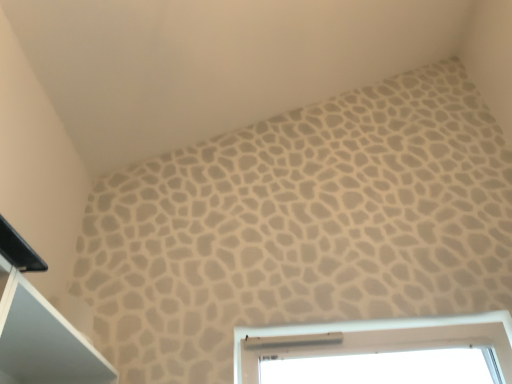
Describe the element at coordinates (42, 339) in the screenshot. I see `black plastic cabinet at upper left` at that location.

Where is `black plastic cabinet at upper left`? The image size is (512, 384). black plastic cabinet at upper left is located at coordinates (42, 339).

Measure the distance between point (90,374) and camera.

A distance of 4.83 feet exists between point (90,374) and camera.

The image size is (512, 384). I want to click on black plastic cabinet at upper left, so click(x=42, y=339).